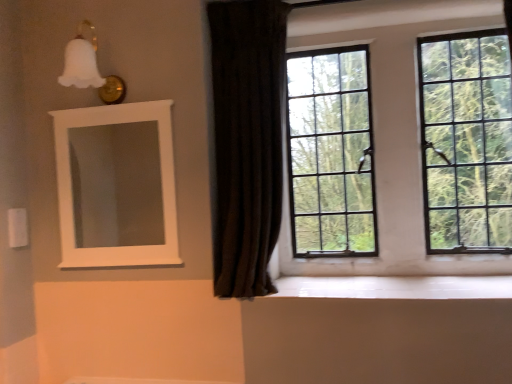
This screenshot has height=384, width=512. What do you see at coordinates (180, 154) in the screenshot? I see `white matte medicine cabinet at upper left` at bounding box center [180, 154].

What do you see at coordinates (388, 135) in the screenshot? The image size is (512, 384). I see `clear glass window at upper right` at bounding box center [388, 135].

Identify the location of dark velvet curtain at center. Image resolution: width=512 pixels, height=384 pixels. (247, 141).

Looking at this image, from the image's perspective, would you say clear glass window at upper right is positioned over dark velvet curtain at center?

Indeed, from the image's perspective, clear glass window at upper right is shown above dark velvet curtain at center.

Is point (434, 13) farther from camera compared to point (241, 131)?

Yes, point (434, 13) is farther from viewer.

From a real-world perspective, is clear glass window at upper right physically above dark velvet curtain at center?

Actually, clear glass window at upper right is physically below dark velvet curtain at center in the real world.

The width and height of the screenshot is (512, 384). I want to click on curtain on the left of the clear glass window at upper right, so click(x=247, y=141).

Can you confirm if clear glass window at upper right is positioned to the left of white matte medicine cabinet at upper left?

Incorrect, clear glass window at upper right is not on the left side of white matte medicine cabinet at upper left.

Where is `medicine cabinet below the clear glass window at upper right (from a real-world perspective)`? This screenshot has width=512, height=384. medicine cabinet below the clear glass window at upper right (from a real-world perspective) is located at coordinates (180, 154).

Is clear glass window at upper right surrounding white matte medicine cabinet at upper left?

Definitely not — white matte medicine cabinet at upper left is not inside clear glass window at upper right.

Which is more to the right, white matte medicine cabinet at upper left or clear glass window at upper right?

clear glass window at upper right.

Based on the photo, which is closer, (187, 227) or (394, 256)?

Point (187, 227) appears to be closer to the viewer than point (394, 256).

Does white matte medicine cabinet at upper left have a larger size compared to clear glass window at upper right?

Incorrect, white matte medicine cabinet at upper left is not larger than clear glass window at upper right.

Considering the positions of objects dark velvet curtain at center and white matte medicine cabinet at upper left in the image provided, who is more to the right, dark velvet curtain at center or white matte medicine cabinet at upper left?

Positioned to the right is dark velvet curtain at center.

From a real-world perspective, does dark velvet curtain at center sit lower than white matte medicine cabinet at upper left?

Incorrect, from a real-world perspective, dark velvet curtain at center is higher than white matte medicine cabinet at upper left.

Considering the sizes of objects dark velvet curtain at center and white matte medicine cabinet at upper left in the image provided, who is smaller, dark velvet curtain at center or white matte medicine cabinet at upper left?

Smaller between the two is white matte medicine cabinet at upper left.

Is dark velvet curtain at center looking in the opposite direction of clear glass window at upper right?

No.

Can you tell me how much dark velvet curtain at center and clear glass window at upper right differ in facing direction?

The angular difference between dark velvet curtain at center and clear glass window at upper right is 2.59 degrees.

Considering the relative positions of dark velvet curtain at center and clear glass window at upper right in the image provided, is dark velvet curtain at center to the left or to the right of clear glass window at upper right?

→ dark velvet curtain at center is positioned on clear glass window at upper right's left side.

How many degrees apart are the facing directions of white glossy wood at lower center and clear glass window at upper right?

They differ by 0.00555 degrees in their facing directions.

Are white glossy wood at lower center and clear glass window at upper right making contact?

No.

From a real-world perspective, between white glossy wood at lower center and clear glass window at upper right, who is vertically lower?

white glossy wood at lower center is physically lower.

Choose the correct answer: Is white glossy wood at lower center inside clear glass window at upper right or outside it?

white glossy wood at lower center is not enclosed by clear glass window at upper right.

From a real-world perspective, which is physically below, white matte medicine cabinet at upper left or dark velvet curtain at center?

white matte medicine cabinet at upper left, from a real-world perspective.

In terms of width, does white matte medicine cabinet at upper left look wider or thinner when compared to dark velvet curtain at center?

Considering their sizes, white matte medicine cabinet at upper left looks slimmer than dark velvet curtain at center.

Based on the photo, considering the sizes of objects white matte medicine cabinet at upper left and dark velvet curtain at center in the image provided, who is bigger, white matte medicine cabinet at upper left or dark velvet curtain at center?

dark velvet curtain at center is bigger.

Where is `curtain below the clear glass window at upper right (from the image's perspective)`? This screenshot has height=384, width=512. curtain below the clear glass window at upper right (from the image's perspective) is located at coordinates (247, 141).

This screenshot has width=512, height=384. I want to click on window above the white matte medicine cabinet at upper left (from the image's perspective), so click(x=388, y=135).

Based on the photo, based on their spatial positions, is white matte medicine cabinet at upper left or white glossy wood at lower center closer to clear glass window at upper right?

The object closer to clear glass window at upper right is white glossy wood at lower center.

Estimate the real-world distances between objects in this image. Which object is further from dark velvet curtain at center, clear glass window at upper right or white glossy wood at lower center?

white glossy wood at lower center is further to dark velvet curtain at center.

When comparing their distances from clear glass window at upper right, does dark velvet curtain at center or white glossy wood at lower center seem further?

dark velvet curtain at center lies further to clear glass window at upper right than the other object.

Consider the image. Looking at the image, which one is located further to white glossy wood at lower center, clear glass window at upper right or white matte medicine cabinet at upper left?

white matte medicine cabinet at upper left is further to white glossy wood at lower center.

Which object lies further to the anchor point white matte medicine cabinet at upper left, white glossy wood at lower center or clear glass window at upper right?

white glossy wood at lower center is positioned further to the anchor white matte medicine cabinet at upper left.

Based on the photo, from the image, which object appears to be farther from white glossy wood at lower center, dark velvet curtain at center or clear glass window at upper right?

dark velvet curtain at center.

Which object lies further to the anchor point white matte medicine cabinet at upper left, white glossy wood at lower center or dark velvet curtain at center?

Among the two, white glossy wood at lower center is located further to white matte medicine cabinet at upper left.

Based on the photo, which object lies further to the anchor point white matte medicine cabinet at upper left, dark velvet curtain at center or white glossy wood at lower center?

white glossy wood at lower center is positioned further to the anchor white matte medicine cabinet at upper left.

Where is `curtain situated between white matte medicine cabinet at upper left and white glossy wood at lower center from left to right`? curtain situated between white matte medicine cabinet at upper left and white glossy wood at lower center from left to right is located at coordinates (247, 141).

You are a GUI agent. You are given a task and a screenshot of the screen. Output one action in this format:
    pyautogui.click(x=<x>, y=<y>)
    Task: Click on the curtain between clear glass window at upper right and white glossy wood at lower center vertically
    This screenshot has height=384, width=512.
    Given the screenshot: What is the action you would take?
    (247, 141)

I want to click on curtain between white matte medicine cabinet at upper left and clear glass window at upper right from left to right, so pos(247,141).

Identify the location of window sill between white matte medicine cabinet at upper left and clear glass window at upper right in the horizontal direction. click(x=396, y=287).